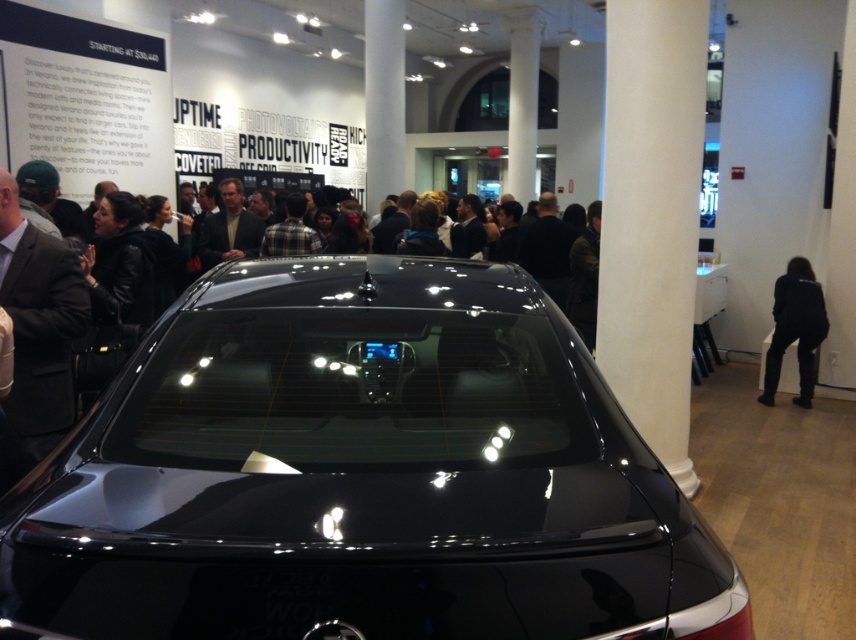
You are attending a car exhibition and notice the glossy black car at center and the black fabric jacket at lower right. Which object is closer to you as you stand at the entrance?

The glossy black car at center is closer to you because it is positioned in front of the black fabric jacket at lower right.

You are a photographer at the event and need to capture a clear photo of the glossy black car at center without the black fabric jacket at lower right appearing in the frame. Based on their sizes, can you adjust your camera angle to exclude the jacket?

The glossy black car at center is larger in size than the black fabric jacket at lower right. Since the car is bigger, you can position yourself to frame the car while the smaller jacket is out of the shot.